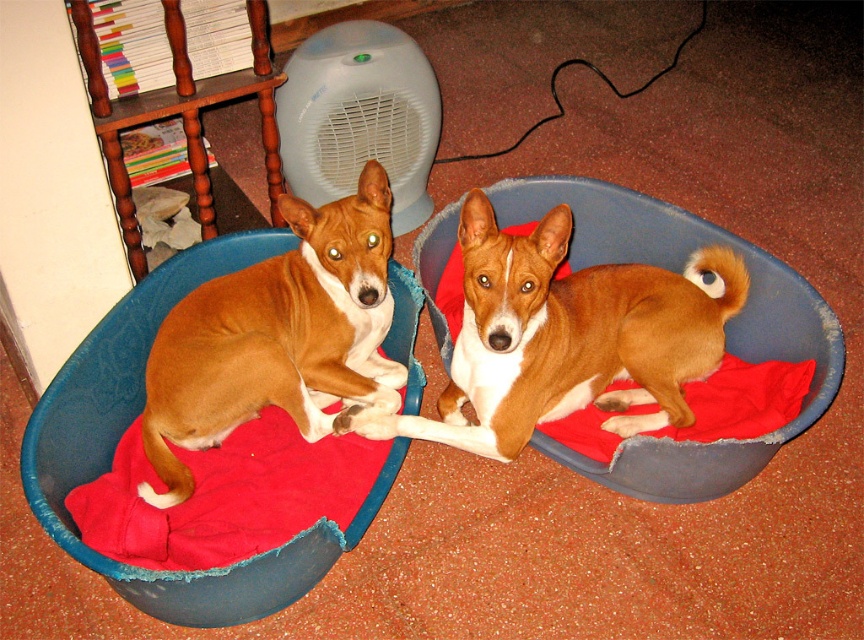
Is velvet-like blue pet bed at left positioned at the back of soft fleece dog bed at center?

That is False.

Who is higher up, velvet-like blue pet bed at left or soft fleece dog bed at center?

soft fleece dog bed at center is above.

This screenshot has height=640, width=864. What do you see at coordinates (135, 417) in the screenshot?
I see `velvet-like blue pet bed at left` at bounding box center [135, 417].

I want to click on velvet-like blue pet bed at left, so click(x=135, y=417).

Can you confirm if brown matte dog at left is thinner than velvet-like blue pet bed at left?

Indeed, brown matte dog at left has a lesser width compared to velvet-like blue pet bed at left.

Between brown matte dog at left and velvet-like blue pet bed at left, which one appears on the right side from the viewer's perspective?

brown matte dog at left is more to the right.

This screenshot has height=640, width=864. Describe the element at coordinates (278, 337) in the screenshot. I see `brown matte dog at left` at that location.

Locate an element on the screen. brown matte dog at left is located at coordinates (278, 337).

Between brown matte dog at left and soft fleece dog bed at center, which one appears on the left side from the viewer's perspective?

brown matte dog at left is more to the left.

Locate an element on the screen. This screenshot has height=640, width=864. brown matte dog at left is located at coordinates (278, 337).

Find the location of `brown matte dog at left`. brown matte dog at left is located at coordinates (278, 337).